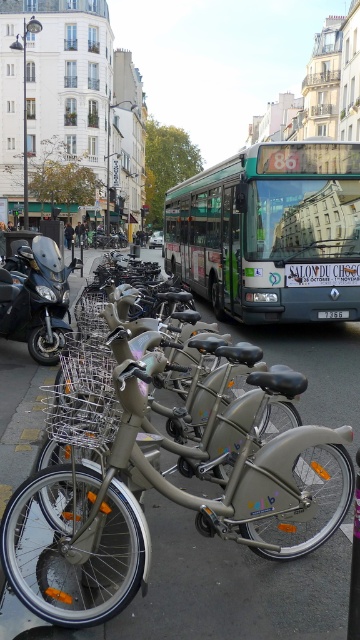
Is the position of green metallic bus at center less distant than that of matte black motorcycle at left?

That is False.

The height and width of the screenshot is (640, 360). What do you see at coordinates (271, 232) in the screenshot?
I see `green metallic bus at center` at bounding box center [271, 232].

Is point (251, 305) farther from viewer compared to point (29, 344)?

Yes, it is.

Where is `green metallic bus at center`? green metallic bus at center is located at coordinates (271, 232).

Is gray asphalt at center taller than matte black motorcycle at left?

Yes.

Can you confirm if gray asphalt at center is shorter than matte black motorcycle at left?

No.

Does point (131, 620) lie in front of point (32, 273)?

Yes, it is in front of point (32, 273).

Where is `gray asphalt at center`? The image size is (360, 640). gray asphalt at center is located at coordinates (227, 589).

Which of these two, gray asphalt at center or green metallic bus at center, stands taller?

Standing taller between the two is green metallic bus at center.

You are a GUI agent. You are given a task and a screenshot of the screen. Output one action in this format:
    pyautogui.click(x=<x>, y=<y>)
    Task: Click on the gray asphalt at center
    This screenshot has height=640, width=360.
    Given the screenshot: What is the action you would take?
    click(227, 589)